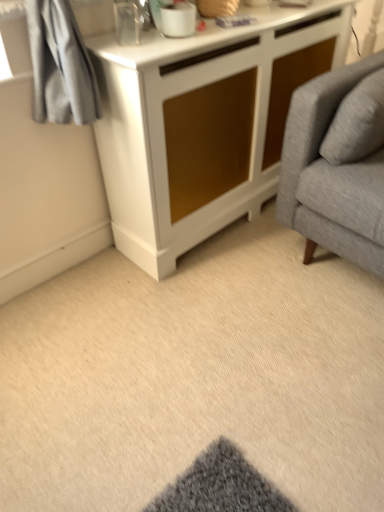
Describe the element at coordinates (174, 17) in the screenshot. The height and width of the screenshot is (512, 384). I see `white glossy mug at upper center` at that location.

Measure the distance between point [101,319] and camera.

Point [101,319] is 5.05 feet away from camera.

Locate an element on the screen. The width and height of the screenshot is (384, 512). white textured cabinet at center is located at coordinates (203, 123).

Locate an element on the screen. This screenshot has height=512, width=384. white glossy mug at upper center is located at coordinates (174, 17).

From a real-world perspective, is beige carpet at lower center physically above white textured cabinet at center?

No, from a real-world perspective, beige carpet at lower center is not above white textured cabinet at center.

Does beige carpet at lower center have a greater width compared to white textured cabinet at center?

Indeed, beige carpet at lower center has a greater width compared to white textured cabinet at center.

Can you confirm if beige carpet at lower center is smaller than white textured cabinet at center?

Yes, beige carpet at lower center is smaller than white textured cabinet at center.

From a real-world perspective, is white glossy mug at upper center on top of beige carpet at lower center?

Correct, in the physical world, white glossy mug at upper center is higher than beige carpet at lower center.

How distant is white glossy mug at upper center from beige carpet at lower center?

white glossy mug at upper center is 3.53 feet from beige carpet at lower center.

Considering the relative sizes of white glossy mug at upper center and beige carpet at lower center in the image provided, is white glossy mug at upper center thinner than beige carpet at lower center?

Yes, white glossy mug at upper center is thinner than beige carpet at lower center.

Is point (180, 30) positioned after point (150, 358)?

That is False.

Consider the image. Could you tell me if beige carpet at lower center is turned towards white glossy mug at upper center?

No, beige carpet at lower center does not turn towards white glossy mug at upper center.

Who is bigger, beige carpet at lower center or white glossy mug at upper center?

beige carpet at lower center is bigger.

From a real-world perspective, which object rests below the other?

From a 3D spatial view, beige carpet at lower center is below.

Which object is positioned more to the left, beige carpet at lower center or white glossy mug at upper center?

white glossy mug at upper center.

Between white textured cabinet at center and beige carpet at lower center, which one has larger width?

beige carpet at lower center is wider.

Is white textured cabinet at center facing towards beige carpet at lower center?

Yes, white textured cabinet at center is facing beige carpet at lower center.

The height and width of the screenshot is (512, 384). Find the location of `plain in front of the white textured cabinet at center`. plain in front of the white textured cabinet at center is located at coordinates (195, 376).

Is beige carpet at lower center surrounded by white textured cabinet at center?

No, beige carpet at lower center is not surrounded by white textured cabinet at center.

Considering the sizes of objects white textured cabinet at center and white glossy mug at upper center in the image provided, who is bigger, white textured cabinet at center or white glossy mug at upper center?

With larger size is white textured cabinet at center.

Does white textured cabinet at center appear on the right side of white glossy mug at upper center?

Indeed, white textured cabinet at center is positioned on the right side of white glossy mug at upper center.

From a real-world perspective, who is located higher, white textured cabinet at center or white glossy mug at upper center?

white glossy mug at upper center is physically above.

Is white glossy mug at upper center surrounded by white textured cabinet at center?

That's incorrect, white glossy mug at upper center is not inside white textured cabinet at center.

Is white glossy mug at upper center at the left side of white textured cabinet at center?

Correct, you'll find white glossy mug at upper center to the left of white textured cabinet at center.

From the picture: Which is closer, (181, 24) or (278, 105)?

Clearly, point (181, 24) is closer to the camera than point (278, 105).

Are white glossy mug at upper center and white textured cabinet at center far apart?

No, there isn't a large distance between white glossy mug at upper center and white textured cabinet at center.

Considering the relative sizes of white glossy mug at upper center and white textured cabinet at center in the image provided, is white glossy mug at upper center bigger than white textured cabinet at center?

No, white glossy mug at upper center is not bigger than white textured cabinet at center.

The width and height of the screenshot is (384, 512). What are the coordinates of `plain in front of the white textured cabinet at center` in the screenshot? It's located at (195, 376).

Image resolution: width=384 pixels, height=512 pixels. Identify the location of plain below the white glossy mug at upper center (from the image's perspective). (195, 376).

Which object lies nearer to the anchor point white textured cabinet at center, beige carpet at lower center or white glossy mug at upper center?

white glossy mug at upper center is positioned closer to the anchor white textured cabinet at center.

From the image, which object appears to be nearer to white textured cabinet at center, white glossy mug at upper center or beige carpet at lower center?

white glossy mug at upper center is closer to white textured cabinet at center.

When comparing their distances from white glossy mug at upper center, does white textured cabinet at center or beige carpet at lower center seem closer?

white textured cabinet at center is closer to white glossy mug at upper center.

Looking at this image, looking at the image, which one is located further to white glossy mug at upper center, beige carpet at lower center or white textured cabinet at center?

beige carpet at lower center lies further to white glossy mug at upper center than the other object.

Based on their spatial positions, is white glossy mug at upper center or white textured cabinet at center closer to beige carpet at lower center?

Based on the image, white textured cabinet at center appears to be nearer to beige carpet at lower center.

When comparing their distances from beige carpet at lower center, does white textured cabinet at center or white glossy mug at upper center seem further?

white glossy mug at upper center is further to beige carpet at lower center.

Locate an element on the screen. This screenshot has height=512, width=384. cabinetry between white glossy mug at upper center and beige carpet at lower center in the vertical direction is located at coordinates point(203,123).